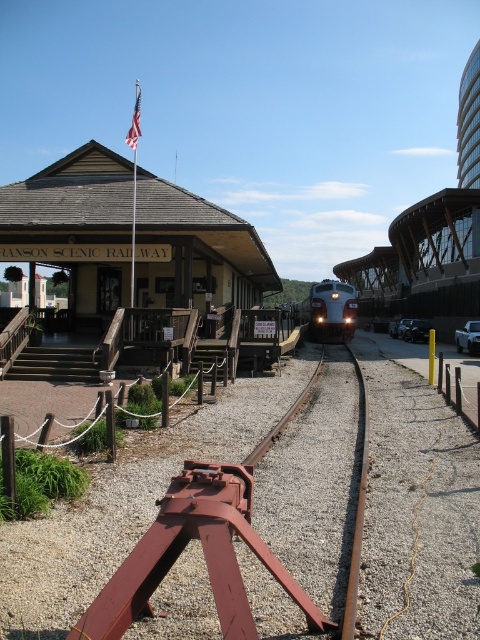
Question: Which object is positioned farthest from the blue polished metal train at center?

Choices:
 (A) silver metallic train at center
 (B) rusty metal train track at center

Answer: (B)

Question: Does brown wooden railway station at left appear over blue polished metal train at center?

Choices:
 (A) no
 (B) yes

Answer: (B)

Question: Observing the image, what is the correct spatial positioning of rusty metal train track at center in reference to metallic silver pickup truck at center?

Choices:
 (A) left
 (B) right

Answer: (A)

Question: Among these points, which one is farthest from the camera?

Choices:
 (A) (159, 572)
 (B) (315, 289)

Answer: (B)

Question: Does silver metallic train at center have a lesser width compared to blue polished metal train at center?

Choices:
 (A) yes
 (B) no

Answer: (B)

Question: Which point is closer to the camera taking this photo?

Choices:
 (A) (476, 332)
 (B) (143, 538)
 (C) (336, 285)
 (D) (327, 280)

Answer: (B)